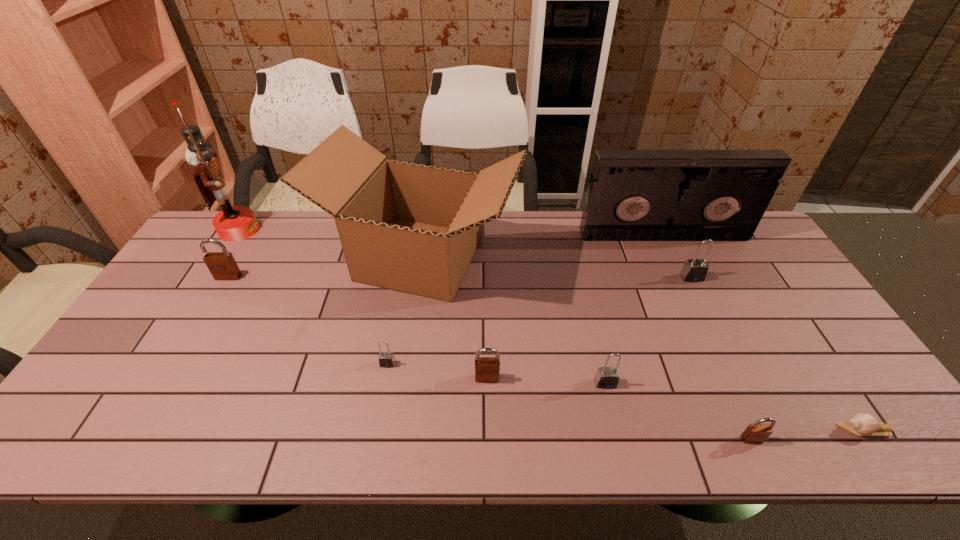
Locate an element on the screen. This screenshot has width=960, height=540. the fourth padlock from right to left is located at coordinates (487, 369).

Where is `the second smallest brown padlock`? The image size is (960, 540). the second smallest brown padlock is located at coordinates tap(487, 369).

What are the coordinates of `the smallest gray padlock` in the screenshot? It's located at (386, 359).

Identify the location of the second farthest gray padlock. (386, 359).

This screenshot has width=960, height=540. In order to click on the smallest brown padlock in this screenshot , I will do `click(755, 433)`.

The width and height of the screenshot is (960, 540). Find the location of `the nearest padlock`. the nearest padlock is located at coordinates (755, 433).

Image resolution: width=960 pixels, height=540 pixels. In order to click on escargot in this screenshot , I will do `click(862, 424)`.

You are a GUI agent. You are given a task and a screenshot of the screen. Output one action in this format:
    pyautogui.click(x=<x>, y=<y>)
    Task: Click on the free space located on the front-facing side of the nutcracker
    This screenshot has width=960, height=540.
    Given the screenshot: What is the action you would take?
    pyautogui.click(x=299, y=230)

Where is `vacant space located 0.390m on the front of the box`? This screenshot has height=540, width=960. vacant space located 0.390m on the front of the box is located at coordinates (393, 445).

The image size is (960, 540). Identify the location of vacant position located on the front side of the black videotape. pyautogui.click(x=691, y=295).